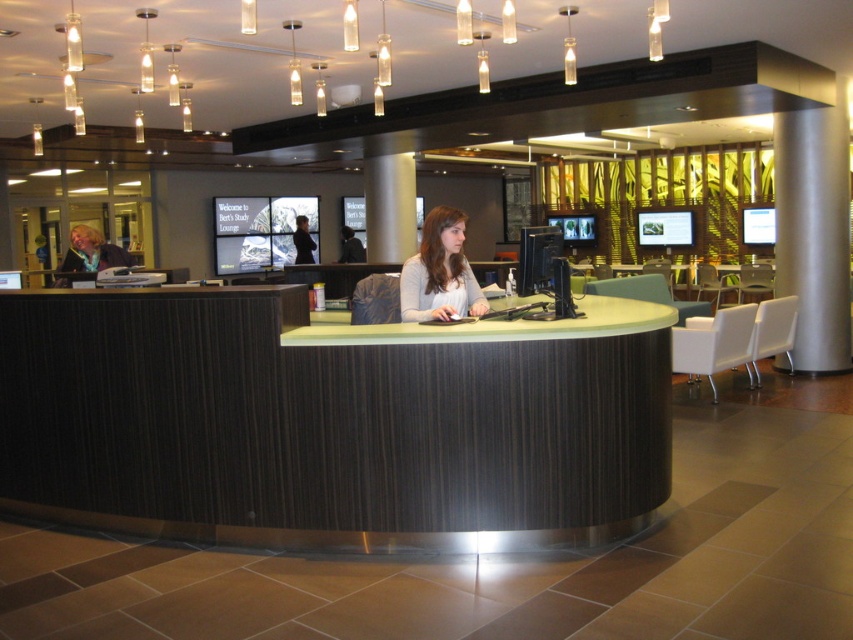
You are a receptionist in the library and need to hang a coat hanger between the light gray sweater at center and the matte black jacket at left. Which object should you place the hanger below to ensure it hangs properly?

The light gray sweater at center is taller than the matte black jacket at left, so you should place the hanger below the light gray sweater at center to ensure it hangs properly.

You are a tailor measuring garments for alterations. You have a light gray sweater at center and a matte black jacket at left. Which garment has a smaller width that needs to be adjusted?

The light gray sweater at center has a smaller width than the matte black jacket at left, so it requires adjustments for its narrower dimensions.